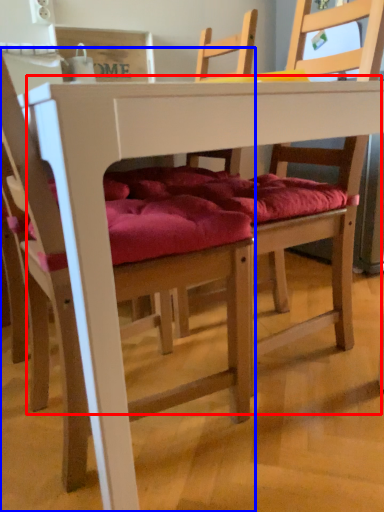
Question: Among these objects, which one is farthest to the camera, table (highlighted by a red box) or chair (highlighted by a blue box)?

Choices:
 (A) table
 (B) chair

Answer: (A)